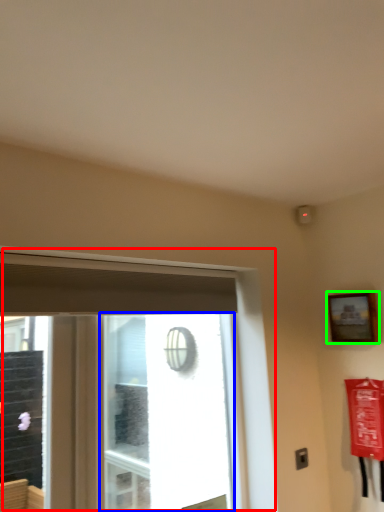
Question: Which object is the closest to the window (highlighted by a red box)? Choose among these: window screen (highlighted by a blue box) or picture frame (highlighted by a green box).

Choices:
 (A) window screen
 (B) picture frame

Answer: (B)